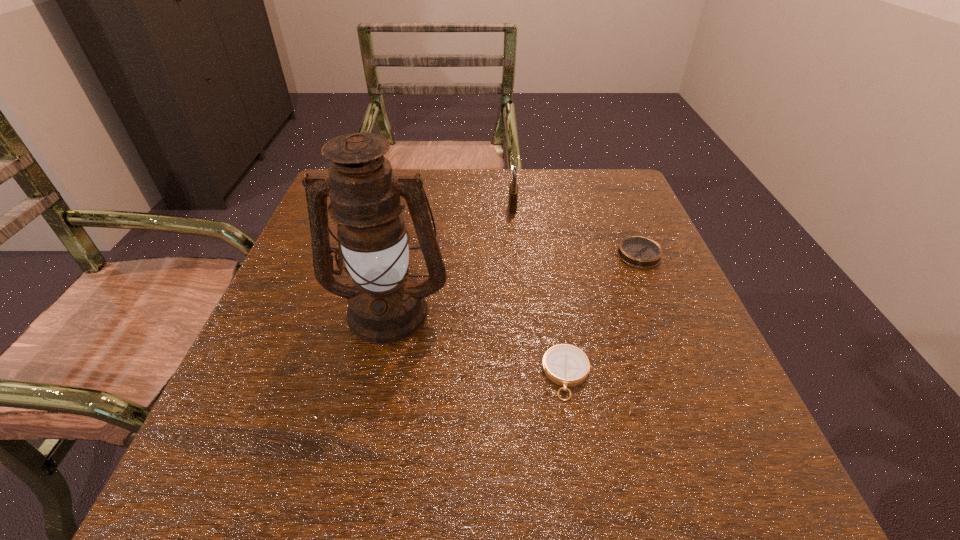
In order to click on object that ranks as the third closest to the nearest object in this screenshot , I will do `click(513, 189)`.

Find the location of a particular element. The height and width of the screenshot is (540, 960). object that is the third closest to the rightmost object is located at coordinates 386,305.

Locate an element on the screen. The height and width of the screenshot is (540, 960). vacant space that satisfies the following two spatial constraints: 1. on the back side of the leftmost object; 2. on the right side of the second object from left to right is located at coordinates (411, 207).

At what (x,y) coordinates should I click in order to perform the action: click on free spot that satisfies the following two spatial constraints: 1. on the front side of the farthest object; 2. on the right side of the nearest object. Please return your answer as a coordinate pair (x, y). The width and height of the screenshot is (960, 540). Looking at the image, I should click on (530, 374).

Where is `free region that satisfies the following two spatial constraints: 1. on the back side of the second nearest object; 2. on the right side of the second tallest object`? The image size is (960, 540). free region that satisfies the following two spatial constraints: 1. on the back side of the second nearest object; 2. on the right side of the second tallest object is located at coordinates (411, 207).